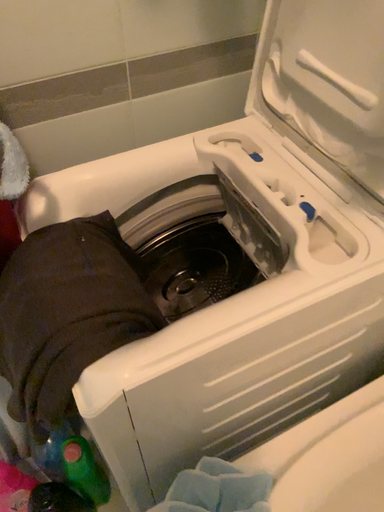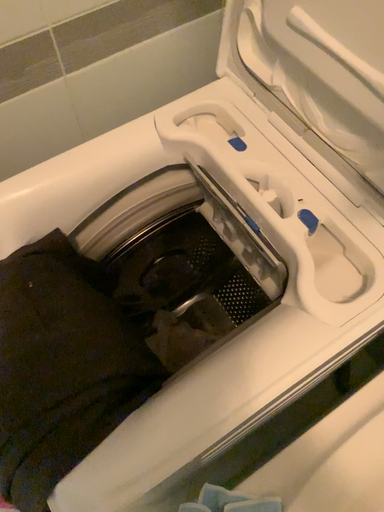
Question: Which way did the camera rotate in the video?

Choices:
 (A) rotated downward
 (B) rotated upward

Answer: (A)